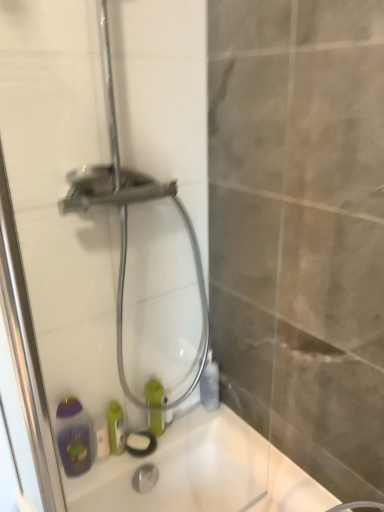
Question: Is green matte bottle at center, which is the second bottle in right-to-left order, not inside transparent glass shower door at center?

Choices:
 (A) yes
 (B) no

Answer: (A)

Question: From the image's perspective, is green matte bottle at center, placed as the 1th bottle when sorted from left to right, located above transparent glass shower door at center?

Choices:
 (A) yes
 (B) no

Answer: (B)

Question: Considering the relative positions of green matte bottle at center, which is the second bottle in right-to-left order, and transparent glass shower door at center in the image provided, is green matte bottle at center, which is the second bottle in right-to-left order, to the right of transparent glass shower door at center from the viewer's perspective?

Choices:
 (A) yes
 (B) no

Answer: (B)

Question: Considering the relative sizes of green matte bottle at center, placed as the 1th bottle when sorted from left to right, and transparent glass shower door at center in the image provided, is green matte bottle at center, placed as the 1th bottle when sorted from left to right, taller than transparent glass shower door at center?

Choices:
 (A) no
 (B) yes

Answer: (A)

Question: Is green matte bottle at center, placed as the 1th bottle when sorted from left to right, closer to the viewer compared to transparent glass shower door at center?

Choices:
 (A) no
 (B) yes

Answer: (A)

Question: Is white matte soap bar at lower left to the left or to the right of white glossy bath at lower left in the image?

Choices:
 (A) left
 (B) right

Answer: (A)

Question: Is point (107, 444) closer or farther from the camera than point (114, 474)?

Choices:
 (A) closer
 (B) farther

Answer: (B)

Question: From their relative heights in the image, would you say white matte soap bar at lower left is taller or shorter than white glossy bath at lower left?

Choices:
 (A) short
 (B) tall

Answer: (A)

Question: Based on their sizes in the image, would you say white matte soap bar at lower left is bigger or smaller than white glossy bath at lower left?

Choices:
 (A) big
 (B) small

Answer: (B)

Question: Considering their positions, is white matte soap bar at lower left located in front of or behind green matte bottle at center, placed as the 1th bottle when sorted from left to right?

Choices:
 (A) behind
 (B) front

Answer: (B)

Question: Is point (104, 452) closer or farther from the camera than point (148, 381)?

Choices:
 (A) farther
 (B) closer

Answer: (B)

Question: From a real-world perspective, is white matte soap bar at lower left positioned above or below green matte bottle at center, placed as the 1th bottle when sorted from left to right?

Choices:
 (A) below
 (B) above

Answer: (A)

Question: Would you say white matte soap bar at lower left is to the left or to the right of green matte bottle at center, placed as the 1th bottle when sorted from left to right, in the picture?

Choices:
 (A) left
 (B) right

Answer: (A)

Question: From the image's perspective, is transparent glass shower door at center above or below green matte bottle at center, placed as the 1th bottle when sorted from left to right?

Choices:
 (A) above
 (B) below

Answer: (A)

Question: Is point (72, 460) positioned closer to the camera than point (150, 393)?

Choices:
 (A) farther
 (B) closer

Answer: (B)